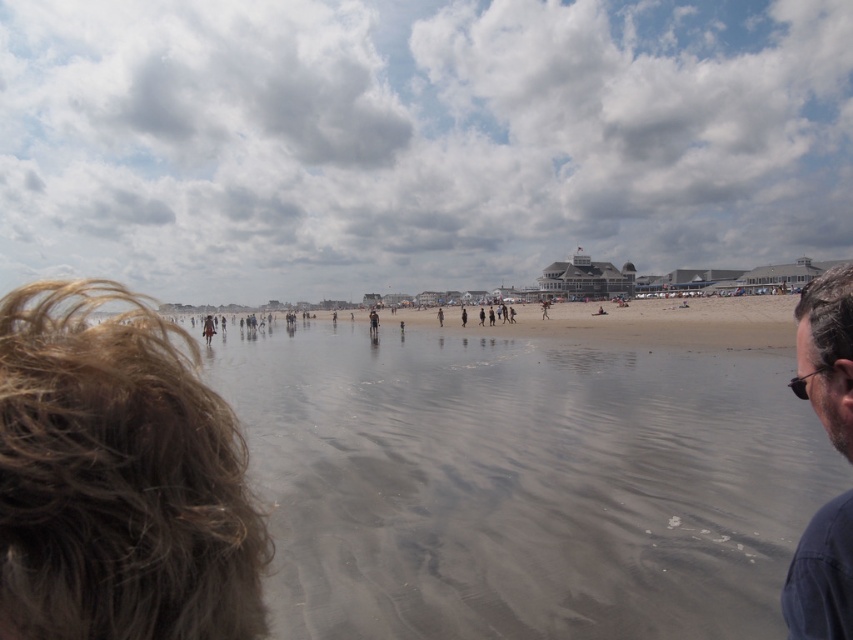
Who is more forward, (128, 602) or (833, 300)?

Positioned in front is point (128, 602).

Can you confirm if brown fuzzy hair at lower left is shorter than dark blue shirt at right?

Yes, brown fuzzy hair at lower left is shorter than dark blue shirt at right.

The width and height of the screenshot is (853, 640). Find the location of `brown fuzzy hair at lower left`. brown fuzzy hair at lower left is located at coordinates (119, 477).

I want to click on brown fuzzy hair at lower left, so click(119, 477).

Consider the image. Does gray sand at lower center come in front of brown fuzzy hair at lower left?

No.

Image resolution: width=853 pixels, height=640 pixels. What do you see at coordinates (521, 483) in the screenshot?
I see `gray sand at lower center` at bounding box center [521, 483].

At what (x,y) coordinates should I click in order to perform the action: click on gray sand at lower center. Please return your answer as a coordinate pair (x, y). Looking at the image, I should click on (521, 483).

Identify the location of gray sand at lower center. The image size is (853, 640). (521, 483).

Does gray sand at lower center have a greater width compared to dark blue shirt at right?

Yes, gray sand at lower center is wider than dark blue shirt at right.

Looking at this image, measure the distance from gray sand at lower center to dark blue shirt at right.

gray sand at lower center is 32.63 meters from dark blue shirt at right.

Is point (291, 484) less distant than point (824, 595)?

No, (291, 484) is further to viewer.

At what (x,y) coordinates should I click in order to perform the action: click on gray sand at lower center. Please return your answer as a coordinate pair (x, y). The image size is (853, 640). Looking at the image, I should click on 521,483.